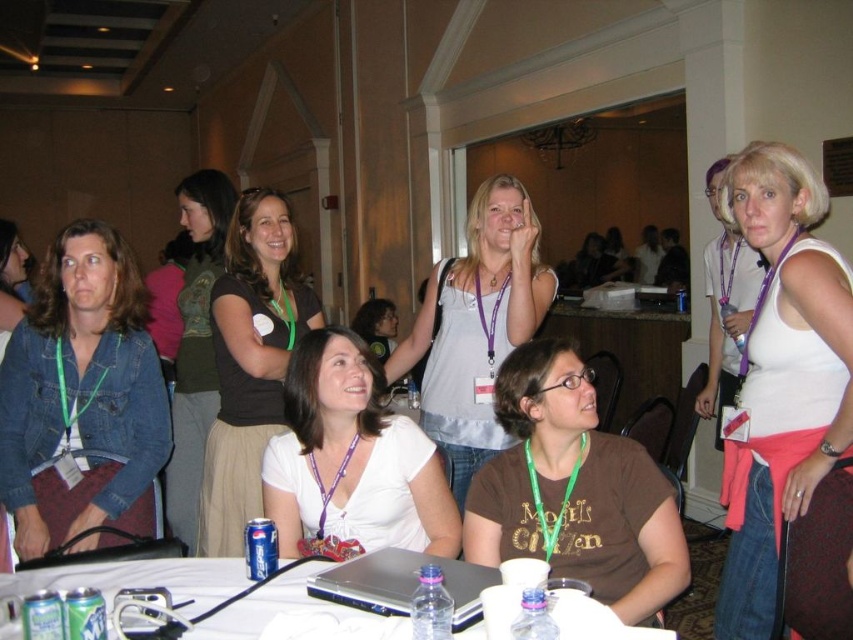
You are a photographer standing in the back of the room. You want to take a photo of both the denim jacket at left and the dark green jersey at center. Since you want both subjects to be clearly visible, which one should you focus on first to ensure proper focus?

The denim jacket at left is not as tall as the dark green jersey at center, so you should focus on the dark green jersey at center first to ensure it is in focus, as it is taller and might be further away.